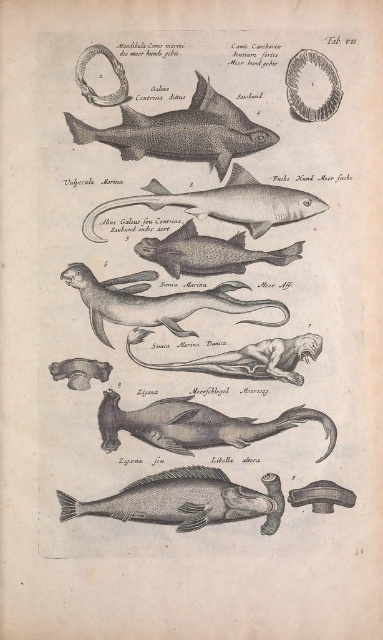
Question: Which object is the farthest from the gray matte shark at upper center?

Choices:
 (A) grayish matte fish at lower center
 (B) gray matte fish at center
 (C) smooth gray seal at center
 (D) grayish matte seal at center

Answer: (A)

Question: Which point appears farthest from the camera in this image?

Choices:
 (A) (232, 195)
 (B) (119, 278)
 (C) (273, 378)
 (D) (78, 508)

Answer: (C)

Question: Does grayish matte fish at lower center have a lesser width compared to grayish metallic sea creature at center?

Choices:
 (A) no
 (B) yes

Answer: (A)

Question: Considering the relative positions of gray matte shark at upper center and grayish matte fish at center in the image provided, where is gray matte shark at upper center located with respect to grayish matte fish at center?

Choices:
 (A) right
 (B) left

Answer: (B)

Question: Is grayish matte fish at lower center thinner than grayish matte fish at center?

Choices:
 (A) no
 (B) yes

Answer: (B)

Question: Which object appears closest to the camera in this image?

Choices:
 (A) matte gray bone at lower center
 (B) grayish matte fish at lower center

Answer: (B)